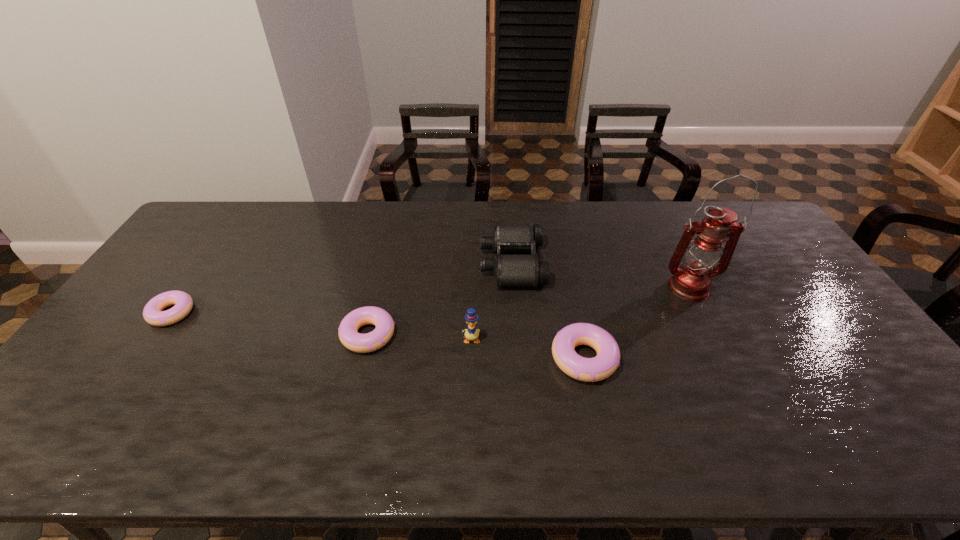
At what (x,y) coordinates should I click in order to perform the action: click on the leftmost object. Please return your answer as a coordinate pair (x, y). This screenshot has height=540, width=960. Looking at the image, I should click on (152, 313).

The height and width of the screenshot is (540, 960). I want to click on the shortest doughnut, so click(152, 313).

Locate an element on the screen. The width and height of the screenshot is (960, 540). the second shortest doughnut is located at coordinates (362, 343).

The image size is (960, 540). I want to click on the second shortest object, so (x=362, y=343).

Where is `the rightmost doughnut`? The height and width of the screenshot is (540, 960). the rightmost doughnut is located at coordinates (598, 368).

Where is `the tallest object`? The height and width of the screenshot is (540, 960). the tallest object is located at coordinates pos(691,281).

Locate an element on the screen. This screenshot has width=960, height=540. the rightmost object is located at coordinates (691, 281).

The width and height of the screenshot is (960, 540). Find the location of `binoculars`. binoculars is located at coordinates (509, 270).

Locate an element on the screen. duckling is located at coordinates (471, 333).

I want to click on the second tallest object, so click(x=471, y=333).